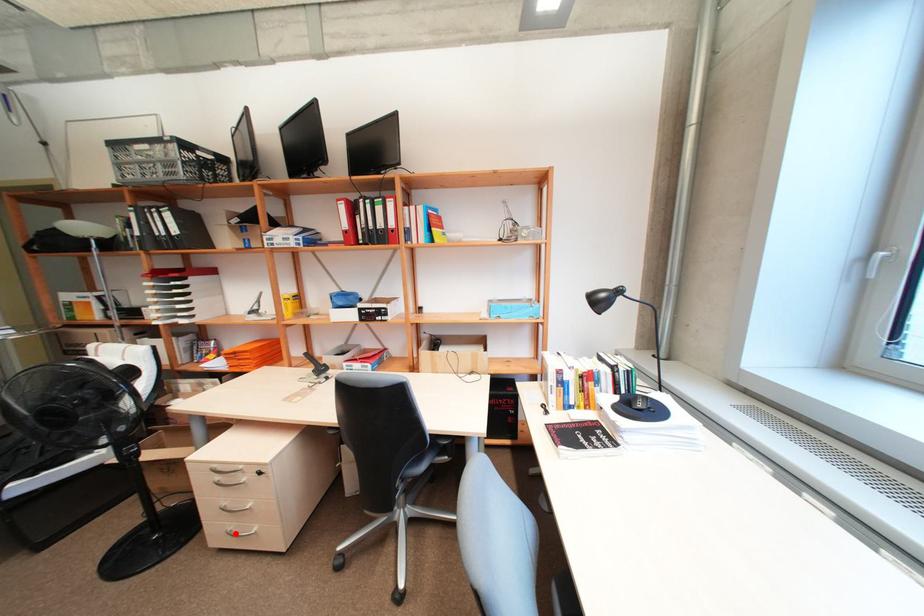
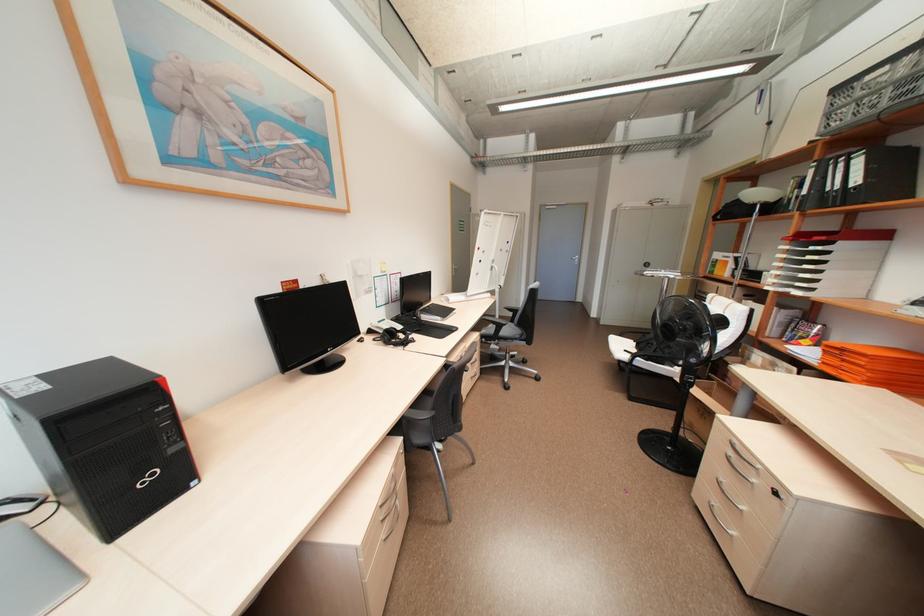
Locate, in the second image, the point that corresponds to the highlighted location in the first image.

(716, 506)